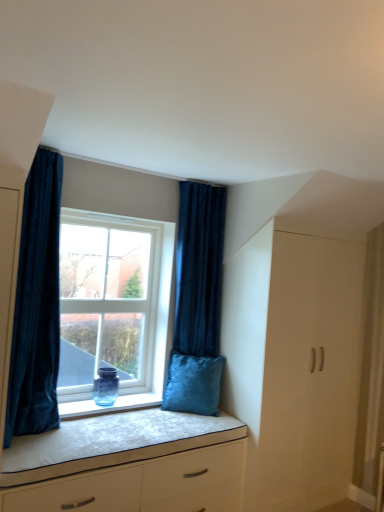
Locate an element on the screen. vacant space to the right of velvet dark blue curtain at left, which is the second curtain in back-to-front order is located at coordinates (89, 436).